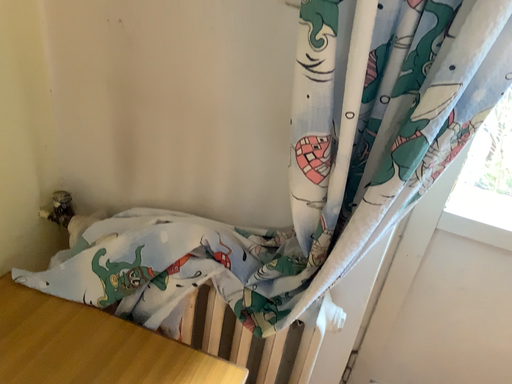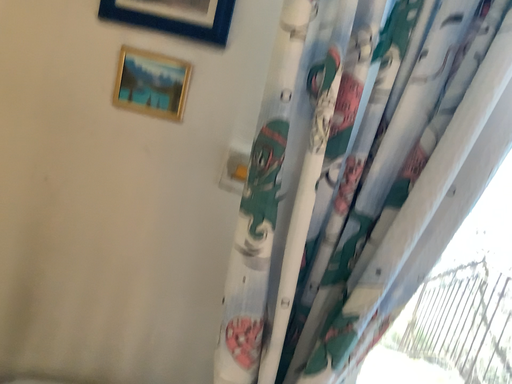
Question: Which way did the camera rotate in the video?

Choices:
 (A) rotated left
 (B) rotated right

Answer: (B)